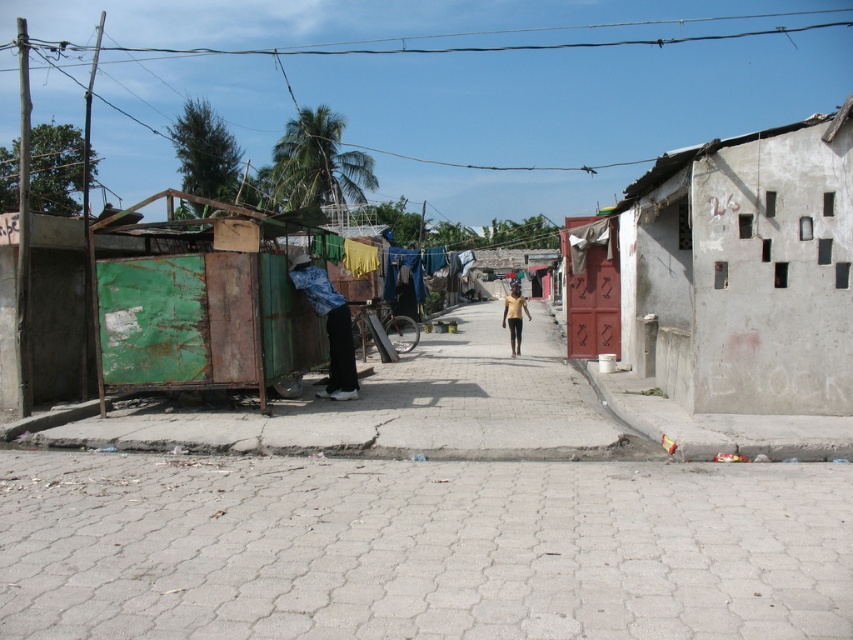
Is denim jacket at left above gold metallic person at center?

Incorrect, denim jacket at left is not positioned above gold metallic person at center.

Locate an element on the screen. The width and height of the screenshot is (853, 640). denim jacket at left is located at coordinates (329, 326).

Does rusty metal container at left appear on the left side of denim jacket at left?

In fact, rusty metal container at left is to the right of denim jacket at left.

Can you confirm if rusty metal container at left is thinner than denim jacket at left?

No, rusty metal container at left is not thinner than denim jacket at left.

Is point (564, 401) positioned before point (334, 372)?

Yes, point (564, 401) is in front of point (334, 372).

I want to click on rusty metal container at left, so click(x=399, y=406).

Can you confirm if white concrete wall at right is bigger than gold metallic person at center?

Yes.

Where is `white concrete wall at right`? The image size is (853, 640). white concrete wall at right is located at coordinates (743, 269).